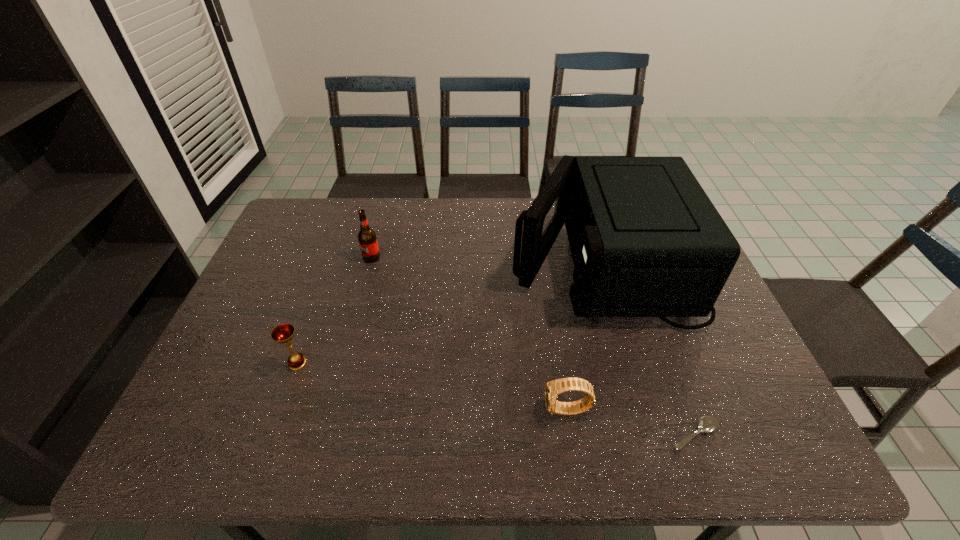
The height and width of the screenshot is (540, 960). I want to click on vacant area that satisfies the following two spatial constraints: 1. with the door open on the tallest object; 2. on the back side of the soupspoon, so click(654, 435).

Find the location of `free region that satisfies the following two spatial constraints: 1. on the back side of the soupspoon; 2. on the face of the fourth tallest object`. free region that satisfies the following two spatial constraints: 1. on the back side of the soupspoon; 2. on the face of the fourth tallest object is located at coordinates (685, 410).

At what (x,y) coordinates should I click in order to perform the action: click on free spot that satisfies the following two spatial constraints: 1. with the door open on the tallest object; 2. on the left side of the soupspoon. Please return your answer as a coordinate pair (x, y). Looking at the image, I should click on (654, 435).

This screenshot has width=960, height=540. Find the location of `free space that satisfies the following two spatial constraints: 1. on the back side of the soupspoon; 2. on the face of the second shortest object`. free space that satisfies the following two spatial constraints: 1. on the back side of the soupspoon; 2. on the face of the second shortest object is located at coordinates (685, 410).